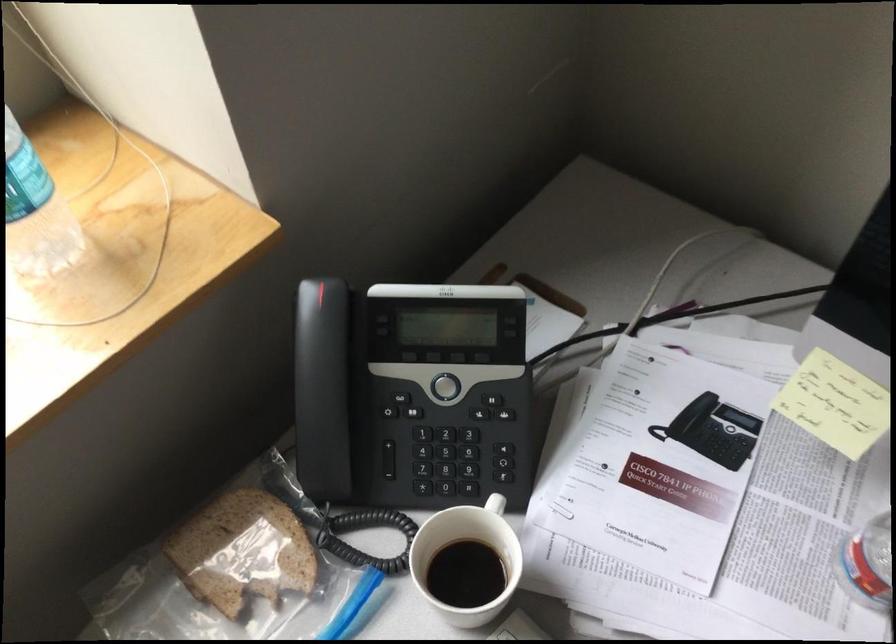
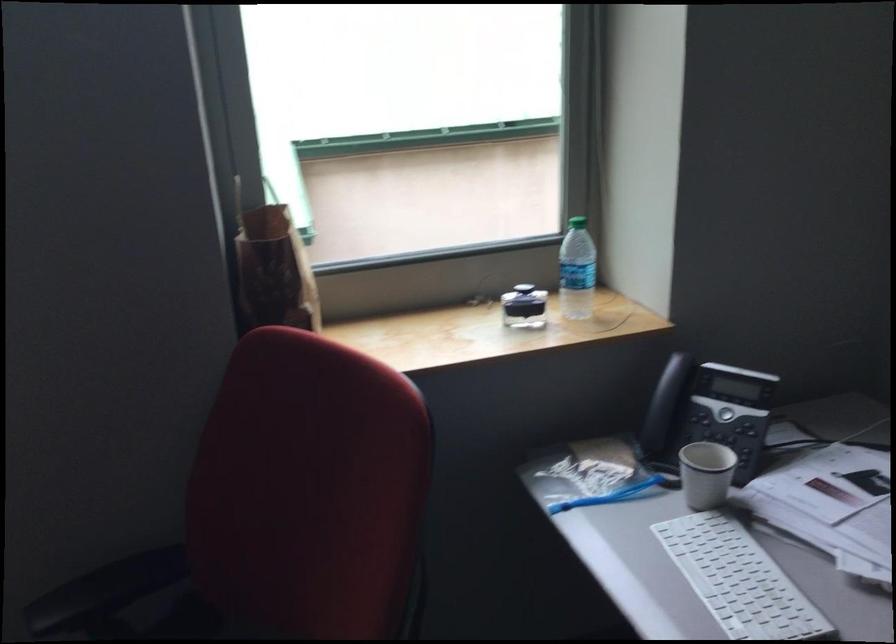
Locate, in the second image, the point that corresponds to (x=397, y=395) in the first image.

(707, 413)